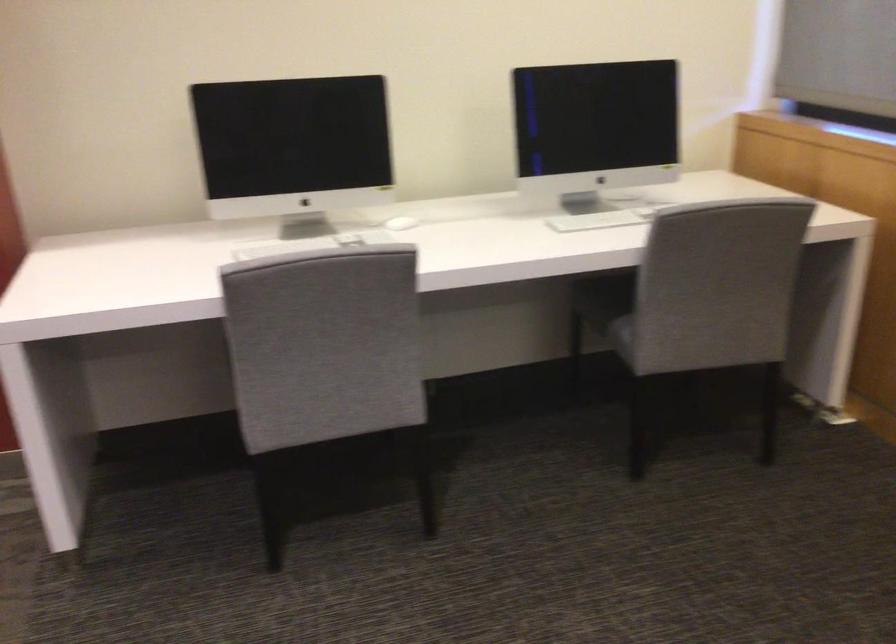
First-person continuous shooting, in which direction is the camera rotating?

The rotation direction of the camera is left-up.